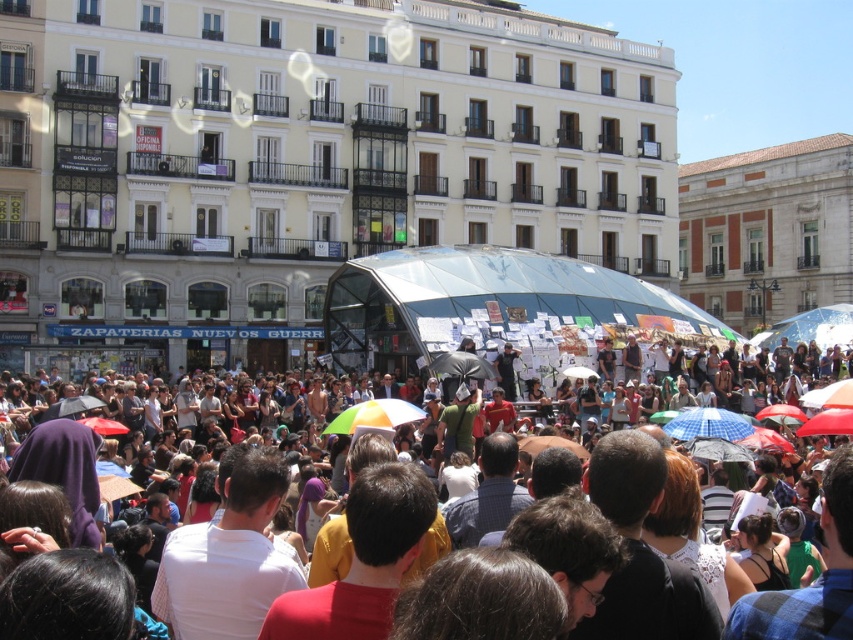
You are standing in the city square and see the blue checkered umbrella at center and the multicolored fabric umbrella at center. Which umbrella is positioned to the right of the other?

The blue checkered umbrella at center is to the right of the multicolored fabric umbrella at center.

You are a photographer trying to capture the crowd in the city square. You notice the multicolored umbrellas at center and the multicolored fabric umbrella at center. Which of these two objects is closer to you?

The multicolored umbrellas at center is in front of the multicolored fabric umbrella at center, so it is closer to you.

You are a street performer preparing to set up your equipment in the city square. You notice the multicolored umbrellas at center and the multicolored fabric umbrella at center. Which of these two items has a larger width?

The multicolored umbrellas at center might be wider than multicolored fabric umbrella at center according to the description provided.